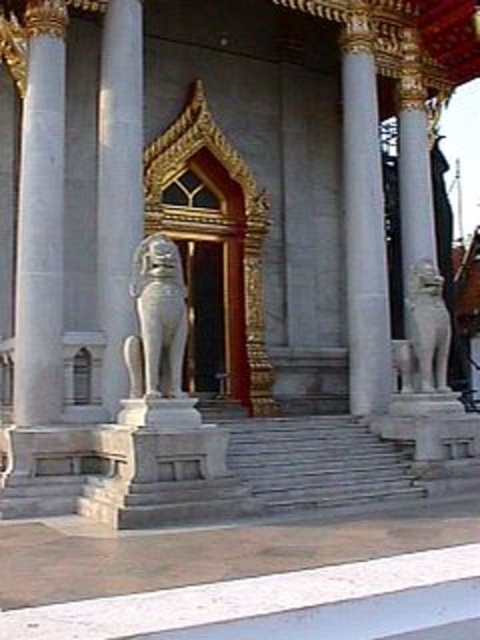
Can you confirm if white marble column at center is wider than white marble lion at left?

No.

Which of these two, white marble column at center or white marble lion at left, stands shorter?

With less height is white marble column at center.

At what (x,y) coordinates should I click in order to perform the action: click on white marble column at center. Please return your answer as a coordinate pair (x, y). Looking at the image, I should click on (363, 225).

Who is higher up, white marble pillar at right or white marble lion at left?

white marble lion at left

Can you confirm if white marble pillar at right is positioned to the left of white marble lion at left?

In fact, white marble pillar at right is to the right of white marble lion at left.

Who is more forward, (408,188) or (171,355)?

Positioned in front is point (171,355).

Identify the location of white marble pillar at right. (420, 243).

Is white marble pillar at center further to camera compared to white stone lion at right?

No, it is in front of white stone lion at right.

Can you confirm if white marble pillar at center is taller than white stone lion at right?

Yes.

Locate an element on the screen. white marble pillar at center is located at coordinates (119, 186).